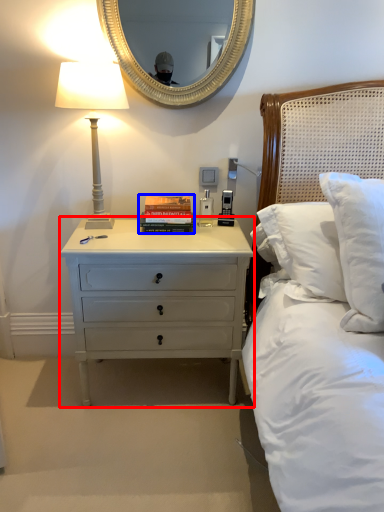
Question: Among these objects, which one is farthest to the camera, nightstand (highlighted by a red box) or paperback book (highlighted by a blue box)?

Choices:
 (A) nightstand
 (B) paperback book

Answer: (B)